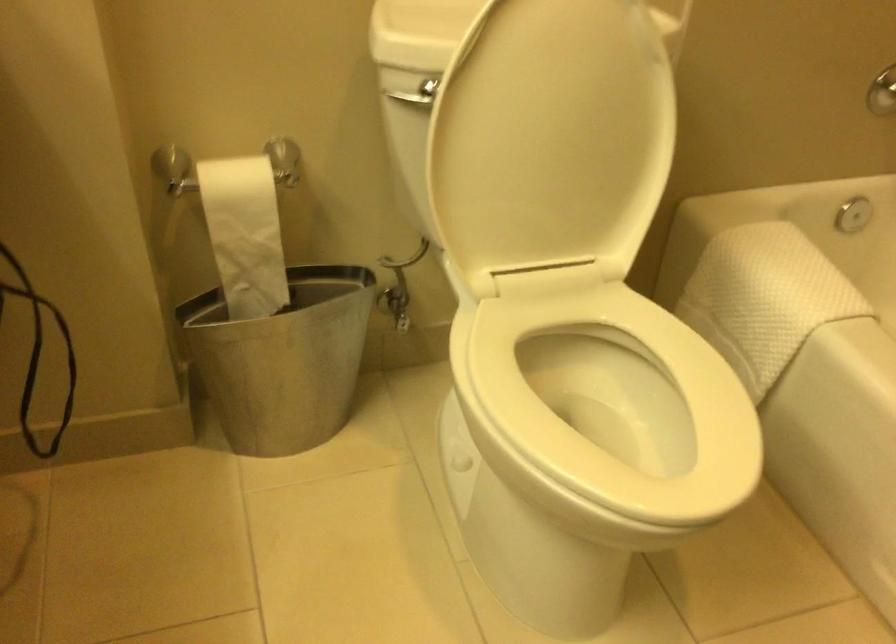
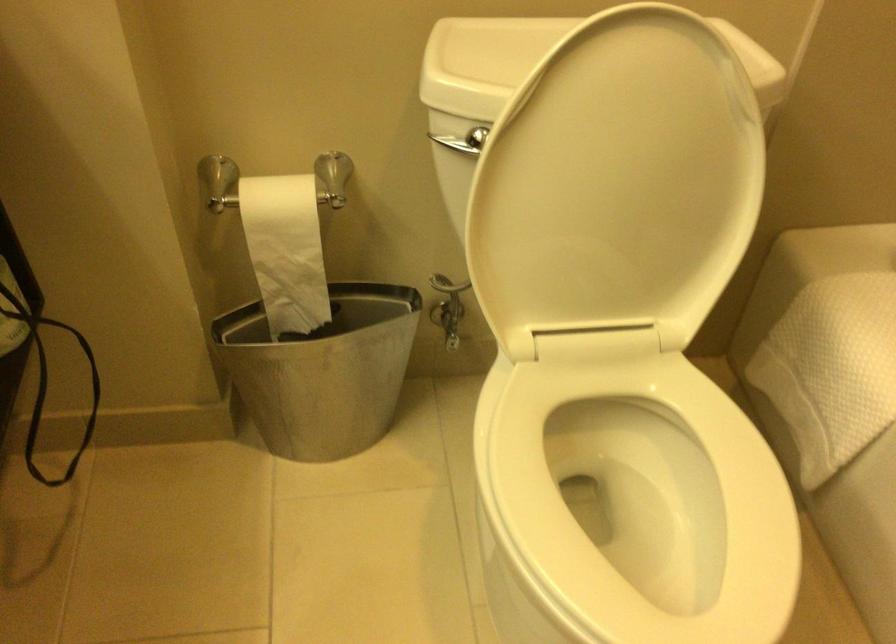
Locate, in the second image, the point that corresponds to point 595,430 in the first image.

(630, 504)